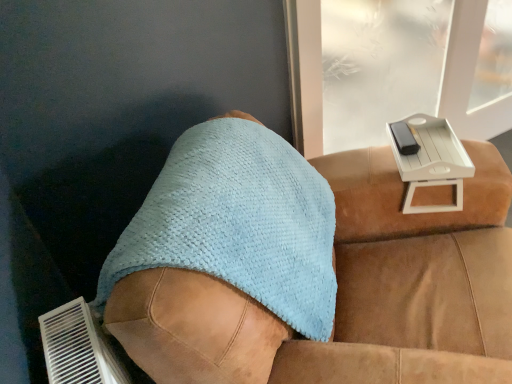
Question: From a real-world perspective, is light blue textured towel at center positioned over light brown leather couch at center based on gravity?

Choices:
 (A) no
 (B) yes

Answer: (B)

Question: Considering the relative sizes of light blue textured towel at center and light brown leather couch at center in the image provided, is light blue textured towel at center thinner than light brown leather couch at center?

Choices:
 (A) no
 (B) yes

Answer: (B)

Question: Is light blue textured towel at center smaller than light brown leather couch at center?

Choices:
 (A) yes
 (B) no

Answer: (A)

Question: Can you confirm if light blue textured towel at center is shorter than light brown leather couch at center?

Choices:
 (A) no
 (B) yes

Answer: (B)

Question: From the image's perspective, is light blue textured towel at center above light brown leather couch at center?

Choices:
 (A) no
 (B) yes

Answer: (B)

Question: From the image's perspective, is light brown leather couch at center positioned above or below white plastic tray at upper right?

Choices:
 (A) above
 (B) below

Answer: (B)

Question: From a real-world perspective, is light brown leather couch at center physically located above or below white plastic tray at upper right?

Choices:
 (A) above
 (B) below

Answer: (B)

Question: Considering their positions, is light brown leather couch at center located in front of or behind white plastic tray at upper right?

Choices:
 (A) front
 (B) behind

Answer: (A)

Question: Which is correct: light brown leather couch at center is inside white plastic tray at upper right, or outside of it?

Choices:
 (A) outside
 (B) inside

Answer: (A)

Question: From the image's perspective, relative to light brown leather couch at center, is light blue textured towel at center above or below?

Choices:
 (A) below
 (B) above

Answer: (B)

Question: Is light blue textured towel at center to the left or to the right of light brown leather couch at center in the image?

Choices:
 (A) right
 (B) left

Answer: (B)

Question: Relative to light brown leather couch at center, is light blue textured towel at center in front or behind?

Choices:
 (A) front
 (B) behind

Answer: (B)

Question: Considering the positions of point (166, 263) and point (303, 312), is point (166, 263) closer or farther from the camera than point (303, 312)?

Choices:
 (A) farther
 (B) closer

Answer: (B)

Question: Considering the positions of light brown leather couch at center and light blue textured towel at center in the image, is light brown leather couch at center taller or shorter than light blue textured towel at center?

Choices:
 (A) tall
 (B) short

Answer: (A)

Question: Considering the positions of light brown leather couch at center and light blue textured towel at center in the image, is light brown leather couch at center wider or thinner than light blue textured towel at center?

Choices:
 (A) wide
 (B) thin

Answer: (A)